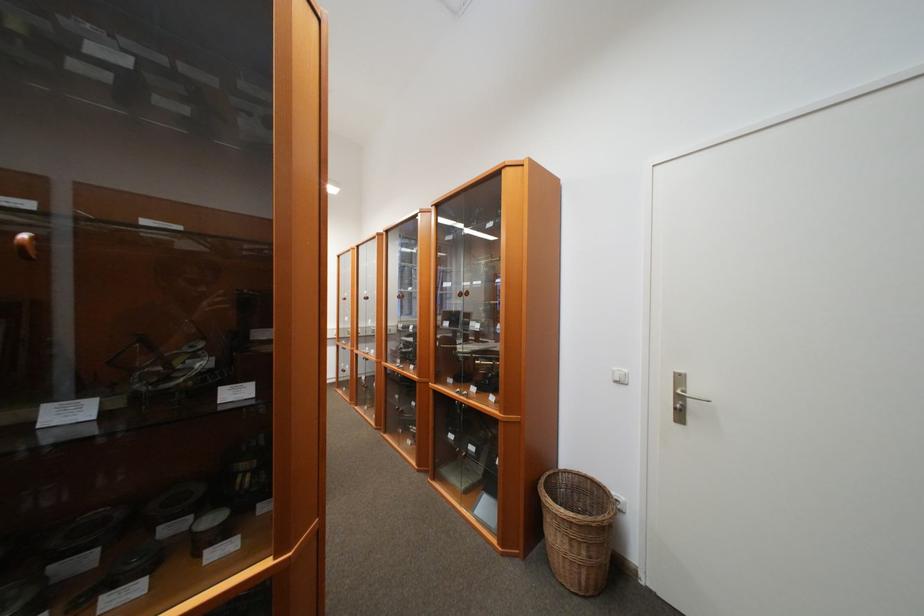
This screenshot has height=616, width=924. In order to click on silver door handle in this screenshot , I will do `click(682, 399)`.